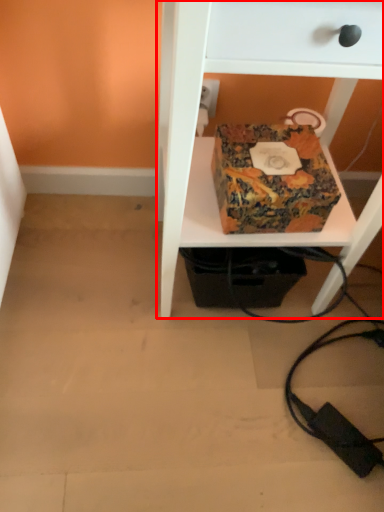
Question: Observing the image, what is the correct spatial positioning of furniture (annotated by the red box) in reference to box?

Choices:
 (A) right
 (B) left

Answer: (A)